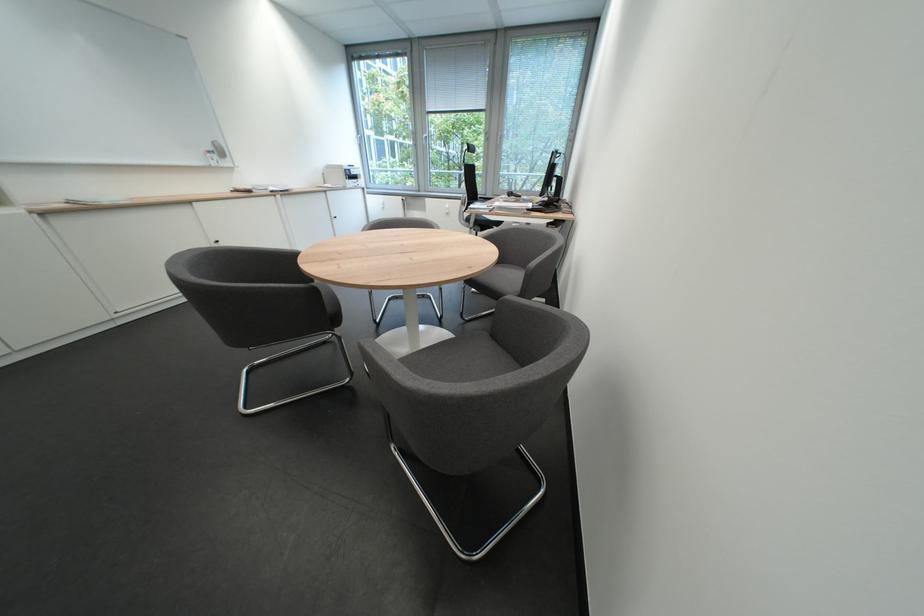
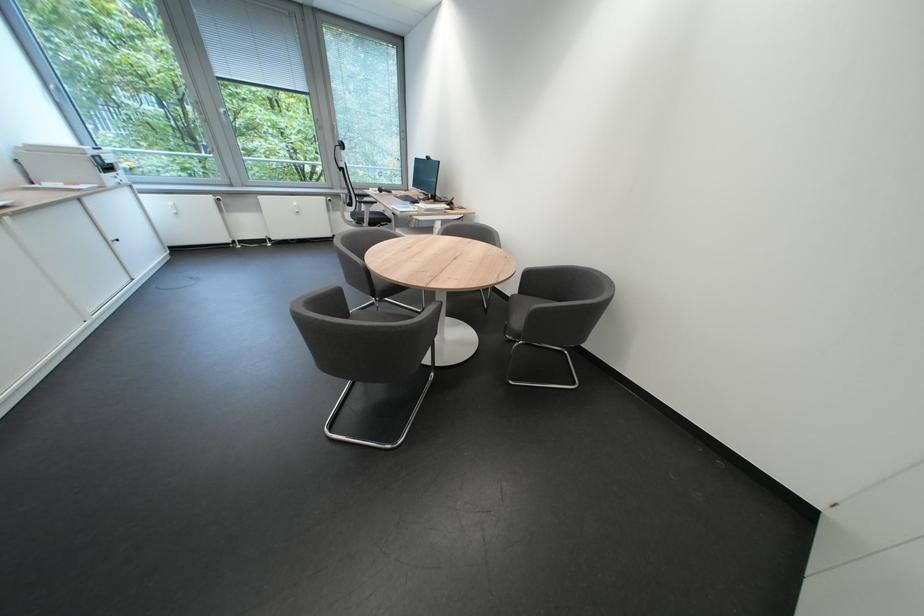
Locate, in the second image, the point that corresponds to (x=484, y=223) in the first image.

(379, 222)